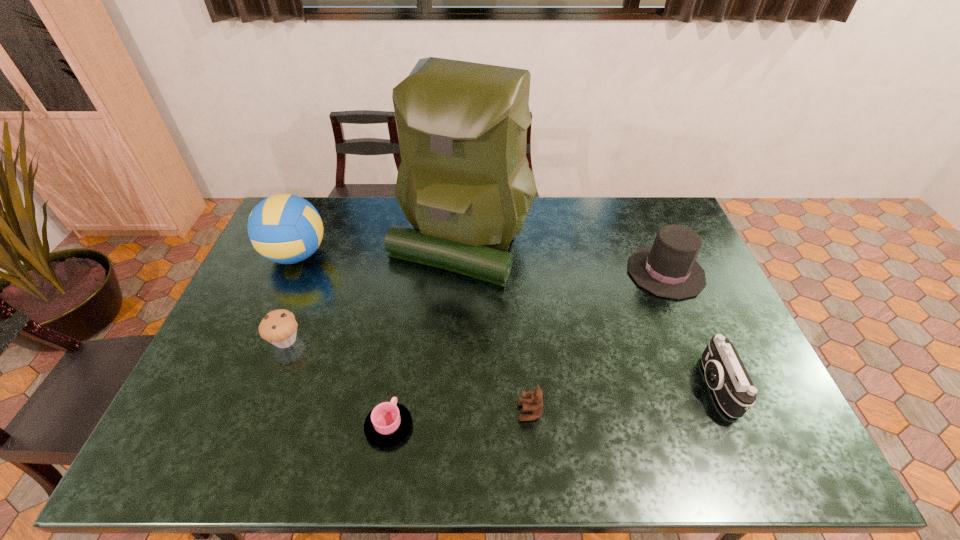
You are a GUI agent. You are given a task and a screenshot of the screen. Output one action in this format:
    pyautogui.click(x=<x>, y=<y>)
    Task: Click on the blank region between the cup and the volleyball
    This screenshot has height=540, width=960.
    Given the screenshot: What is the action you would take?
    pyautogui.click(x=343, y=341)

Identify the location of vacant area that lies between the fifth shortest object and the fourth tallest object. Image resolution: width=960 pixels, height=540 pixels. (691, 329).

I want to click on free space between the muffin and the second tallest object, so click(291, 298).

The width and height of the screenshot is (960, 540). What are the coordinates of `free space between the muffin and the teddy bear` in the screenshot? It's located at (408, 376).

You are a GUI agent. You are given a task and a screenshot of the screen. Output one action in this format:
    pyautogui.click(x=<x>, y=<y>)
    Task: Click on the free spot between the volleyball and the teddy bear
    This screenshot has height=540, width=960.
    Given the screenshot: What is the action you would take?
    pyautogui.click(x=413, y=333)

Locate which object is the sixth closest to the camera. Please provide its 2D coordinates. Your answer should be formatted as a tuple, i.e. [(x, y)], where the tuple contains the x and y coordinates of a point satisfying the conditions above.

[(284, 228)]

Where is `object that is the sixth closest one to the camera`? This screenshot has height=540, width=960. object that is the sixth closest one to the camera is located at coordinates (284, 228).